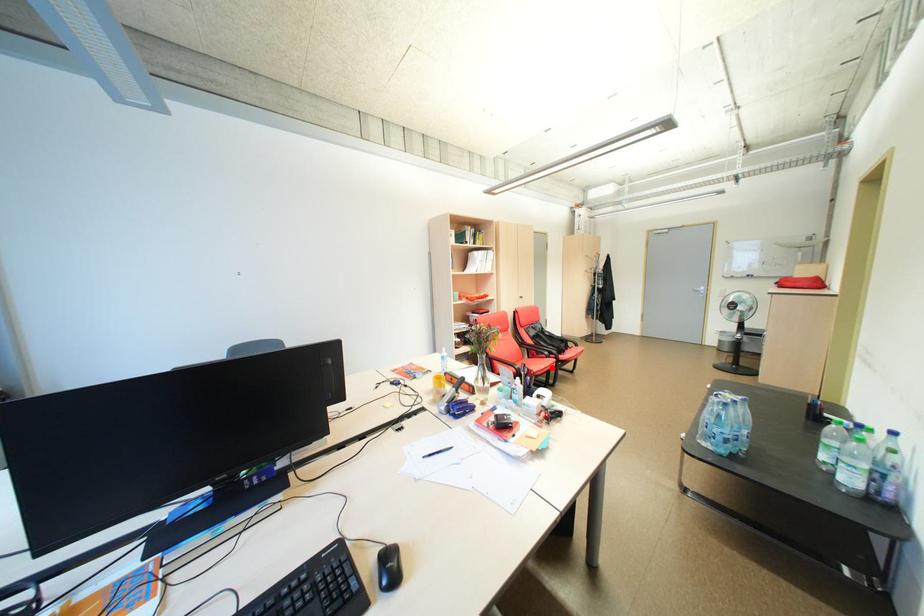
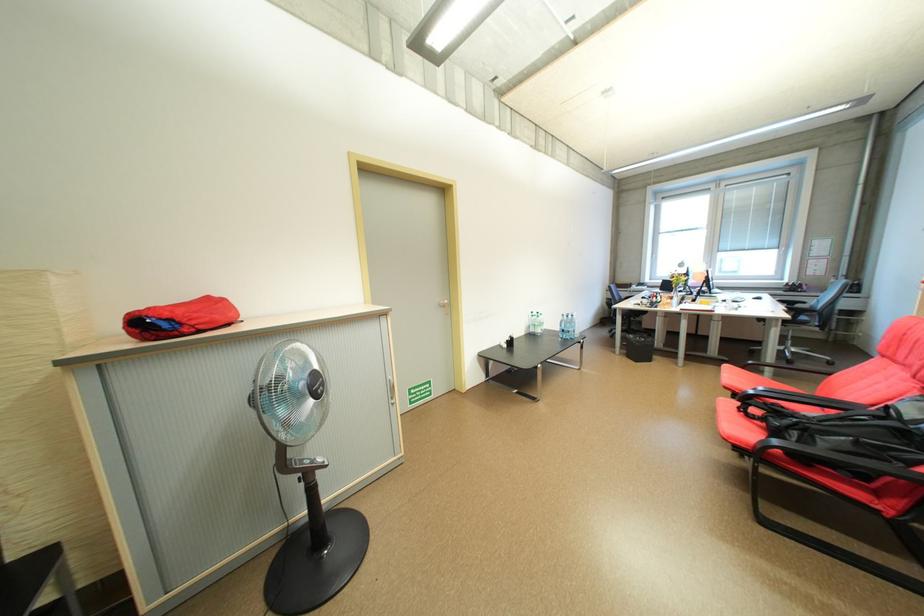
The point at the highlighted location is marked in the first image. Where is the corresponding point in the second image?

(734, 376)